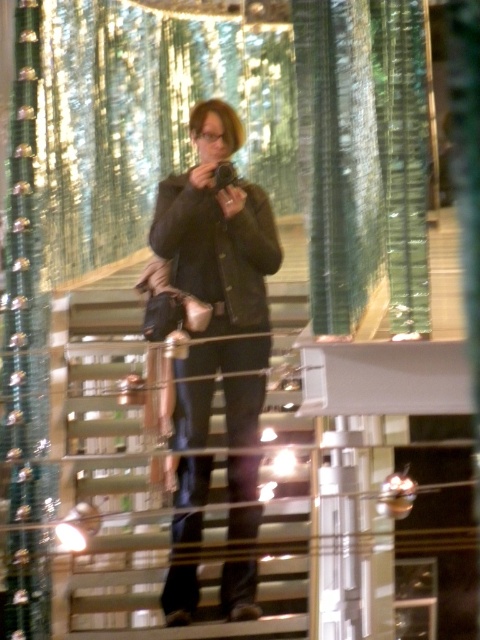
Based on the photo, you are a photographer trying to position a matte black jacket at center on a metallic silver stairwell at center. Given the stairwell is narrower than the jacket, will the jacket fit entirely on the stairwell?

The metallic silver stairwell at center is narrower than the matte black jacket at center, so the jacket will not fit entirely on the stairwell.

Based on the scene description, where is the metallic silver stairwell at center located in terms of its 2D coordinates?

The metallic silver stairwell at center is located at the 2D coordinates of point (164,493).

You are trying to decide whether to place a new decorative item on the metallic silver stairwell at center or on the matte black jacket at center. Based on their sizes, which surface would be more suitable for a larger decorative item?

The matte black jacket at center is larger than the metallic silver stairwell at center, so it can accommodate a larger decorative item.